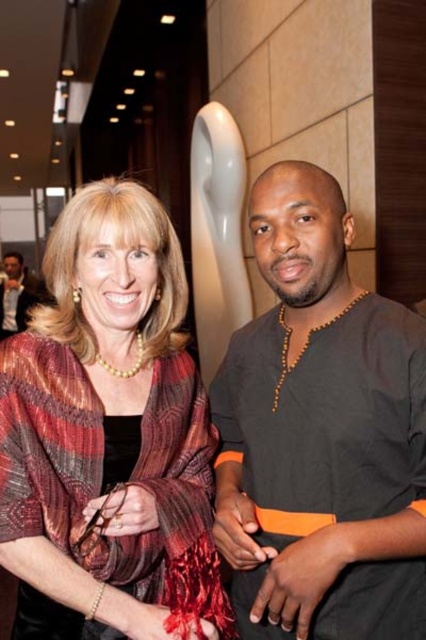
Who is taller, matte red scarf at center or black matte shirt at right?

With more height is matte red scarf at center.

Does matte red scarf at center have a lesser width compared to black matte shirt at right?

Incorrect, matte red scarf at center's width is not less than black matte shirt at right's.

Identify the location of matte red scarf at center. (109, 436).

Which of these two, black matte shirt at right or matte black shirt at left, stands taller?

With more height is matte black shirt at left.

Who is shorter, black matte shirt at right or matte black shirt at left?

With less height is black matte shirt at right.

Is point (325, 524) behind point (23, 288)?

That is False.

Where is `black matte shirt at right`? The width and height of the screenshot is (426, 640). black matte shirt at right is located at coordinates (322, 429).

Is matte red scarf at center below matte black shirt at left?

Yes, matte red scarf at center is below matte black shirt at left.

Looking at this image, can you confirm if matte red scarf at center is wider than matte black shirt at left?

In fact, matte red scarf at center might be narrower than matte black shirt at left.

Is point (77, 388) farther from viewer compared to point (26, 288)?

No, it is in front of (26, 288).

Locate an element on the screen. The width and height of the screenshot is (426, 640). matte red scarf at center is located at coordinates (109, 436).